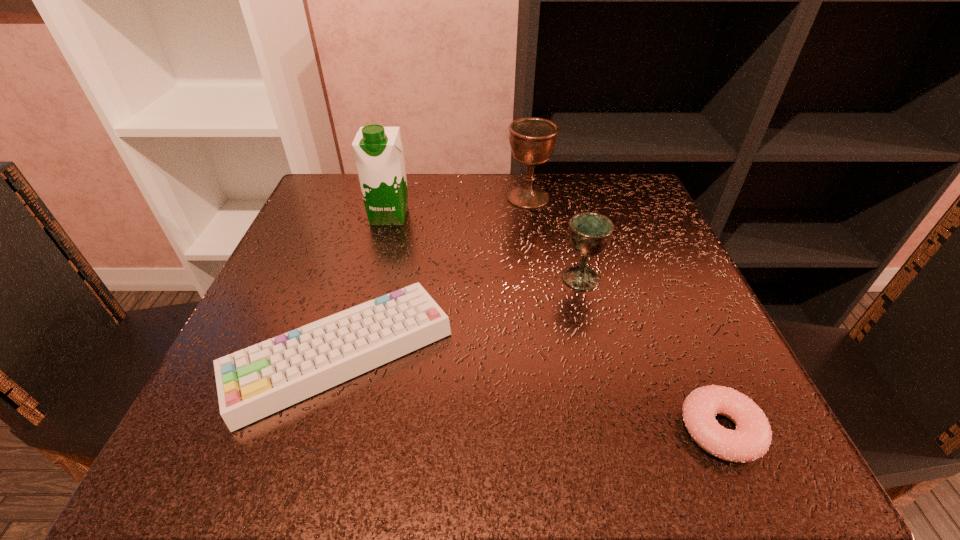
This screenshot has height=540, width=960. Identify the location of object that stands as the closest to the computer keyboard. (378, 150).

Find the location of a particular element. Image resolution: width=960 pixels, height=540 pixels. object that is the second closest to the doughnut is located at coordinates (255, 382).

Where is `free space that satisfies the following two spatial constraints: 1. on the front-facing side of the soya milk; 2. on the right side of the nearer chalice`? This screenshot has width=960, height=540. free space that satisfies the following two spatial constraints: 1. on the front-facing side of the soya milk; 2. on the right side of the nearer chalice is located at coordinates (372, 278).

Identify the location of free space that satisfies the following two spatial constraints: 1. on the front side of the doughnut; 2. on the left side of the nearer chalice. (x=619, y=430).

Where is `vacant space that satisfies the following two spatial constraints: 1. on the front side of the shortest object; 2. on the left side of the nearer chalice`? vacant space that satisfies the following two spatial constraints: 1. on the front side of the shortest object; 2. on the left side of the nearer chalice is located at coordinates (619, 430).